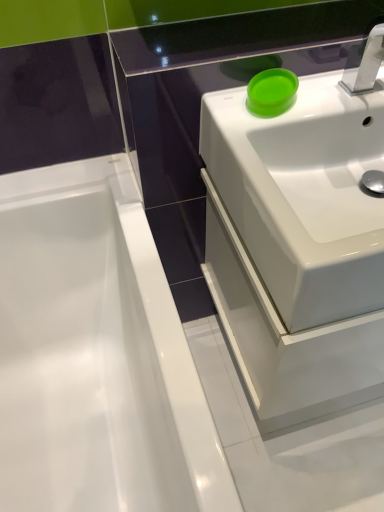
Question: Is silver metallic tap at upper right behind matte green bowl at upper right?

Choices:
 (A) yes
 (B) no

Answer: (B)

Question: From a real-world perspective, is silver metallic tap at upper right under matte green bowl at upper right?

Choices:
 (A) yes
 (B) no

Answer: (B)

Question: Considering the relative sizes of silver metallic tap at upper right and matte green bowl at upper right in the image provided, is silver metallic tap at upper right taller than matte green bowl at upper right?

Choices:
 (A) no
 (B) yes

Answer: (B)

Question: Is silver metallic tap at upper right wider than matte green bowl at upper right?

Choices:
 (A) yes
 (B) no

Answer: (A)

Question: Is silver metallic tap at upper right smaller than matte green bowl at upper right?

Choices:
 (A) no
 (B) yes

Answer: (A)

Question: From the image's perspective, is silver metallic tap at upper right located beneath matte green bowl at upper right?

Choices:
 (A) no
 (B) yes

Answer: (A)

Question: Is white glossy bathtub at left next to matte green bowl at upper right?

Choices:
 (A) no
 (B) yes

Answer: (A)

Question: Is white glossy bathtub at left bigger than matte green bowl at upper right?

Choices:
 (A) no
 (B) yes

Answer: (B)

Question: From a real-world perspective, is white glossy bathtub at left positioned under matte green bowl at upper right based on gravity?

Choices:
 (A) no
 (B) yes

Answer: (B)

Question: Is the depth of white glossy bathtub at left greater than that of matte green bowl at upper right?

Choices:
 (A) no
 (B) yes

Answer: (A)

Question: From a real-world perspective, is white glossy bathtub at left on top of matte green bowl at upper right?

Choices:
 (A) no
 (B) yes

Answer: (A)

Question: Can you confirm if white glossy bathtub at left is thinner than matte green bowl at upper right?

Choices:
 (A) yes
 (B) no

Answer: (B)

Question: Is silver metallic tap at upper right at the back of white glossy bathtub at left?

Choices:
 (A) yes
 (B) no

Answer: (B)